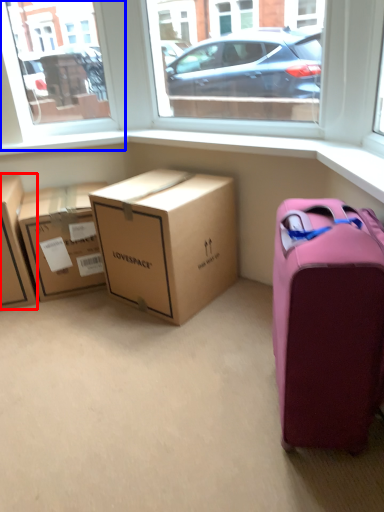
Question: Which object is further to the camera taking this photo, box (highlighted by a red box) or window screen (highlighted by a blue box)?

Choices:
 (A) box
 (B) window screen

Answer: (B)